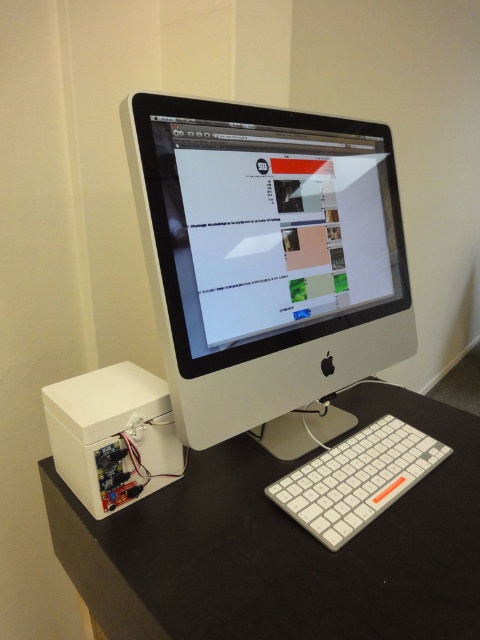
Question: Can you confirm if white plastic computer monitor at center is positioned below white matte/black plastic computer desk at lower left?

Choices:
 (A) no
 (B) yes

Answer: (A)

Question: Considering the relative positions of white plastic computer monitor at center and white matte/black plastic computer desk at lower left in the image provided, where is white plastic computer monitor at center located with respect to white matte/black plastic computer desk at lower left?

Choices:
 (A) below
 (B) above

Answer: (B)

Question: Among these points, which one is farthest from the camera?

Choices:
 (A) (402, 424)
 (B) (168, 541)

Answer: (A)

Question: Considering the real-world distances, which object is farthest from the white plastic computer monitor at center?

Choices:
 (A) white matte/black plastic computer desk at lower left
 (B) white plastic keyboard at lower right

Answer: (B)

Question: Which object is farther from the camera taking this photo?

Choices:
 (A) white matte/black plastic computer desk at lower left
 (B) white plastic computer monitor at center
 (C) white plastic keyboard at lower right

Answer: (C)

Question: From the image, what is the correct spatial relationship of white matte/black plastic computer desk at lower left in relation to white plastic keyboard at lower right?

Choices:
 (A) above
 (B) below

Answer: (B)